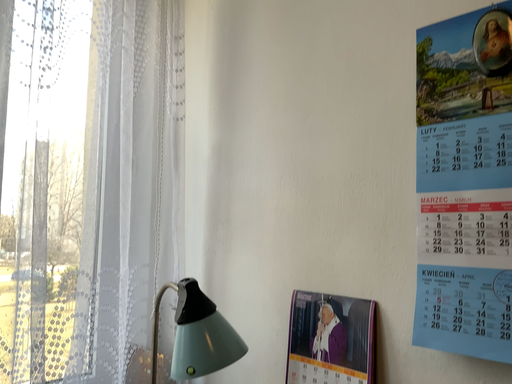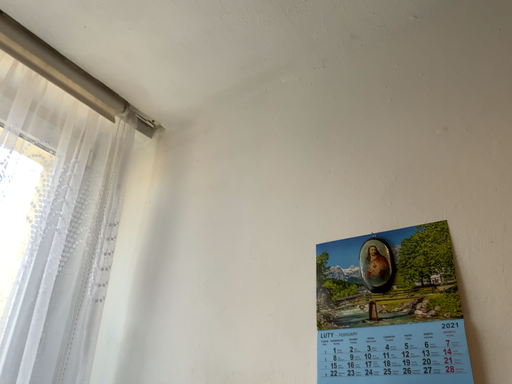
Question: Which way did the camera rotate in the video?

Choices:
 (A) rotated left
 (B) rotated right

Answer: (B)